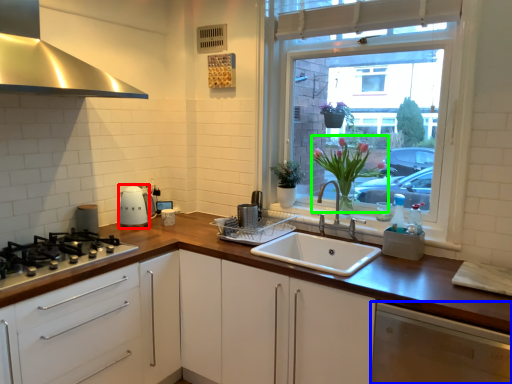
Question: Considering the real-world distances, which object is closest to appliance (highlighted by a red box)? cabinetry (highlighted by a blue box) or floral arrangement (highlighted by a green box).

Choices:
 (A) cabinetry
 (B) floral arrangement

Answer: (B)